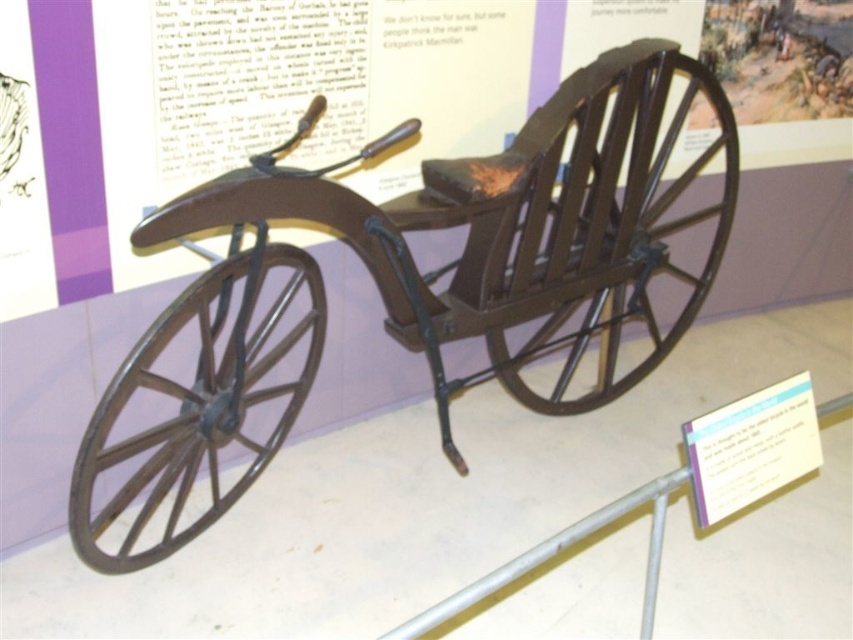
You are standing in front of the vintage carriage display. There are two points marked on the carriage, one at coordinates point [256,468] and the other at point [653,131]. If you were to walk around the display, which point would you encounter first when approaching from the front?

Point [256,468] is in front of point [653,131], so you would encounter point [256,468] first when approaching from the front.

You are standing in front of the vintage carriage display. There are two points marked on the carriage, one at point coordinates point (x=498, y=180) and another at point (x=164, y=320). Which point is closer to your viewpoint?

Point (x=498, y=180) is further to the camera than point (x=164, y=320), so the point closer to your viewpoint is point (x=164, y=320).